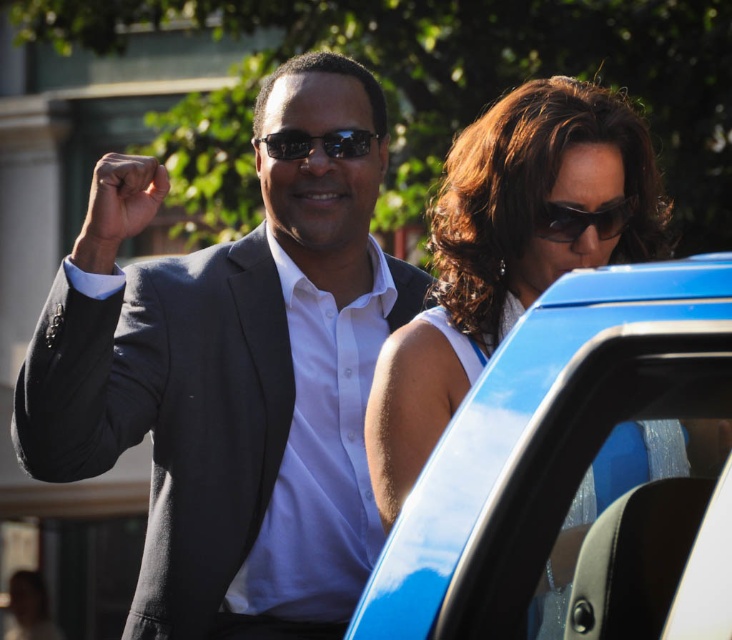
You are standing at the origin of the coordinate system in this image. There are two points marked in the scene. The first point is at coordinates point [612,221] and the second point is at coordinates point [299,156]. If you were to walk towards the first point, would you pass by the second point along the way?

Yes, because point [612,221] is in front of point [299,156], so walking towards the first point would require passing by the second point along the way.